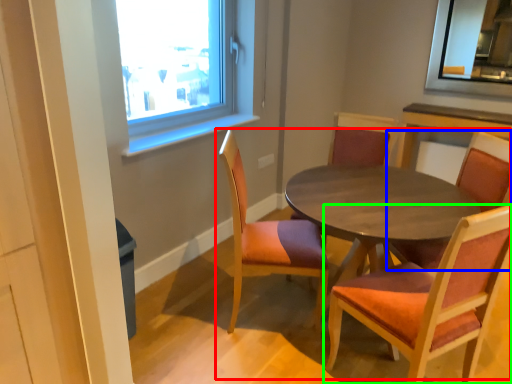
Question: Which is nearer to the kitchen & dining room table (highlighted by a red box)? chair (highlighted by a blue box) or chair (highlighted by a green box).

Choices:
 (A) chair
 (B) chair

Answer: (A)